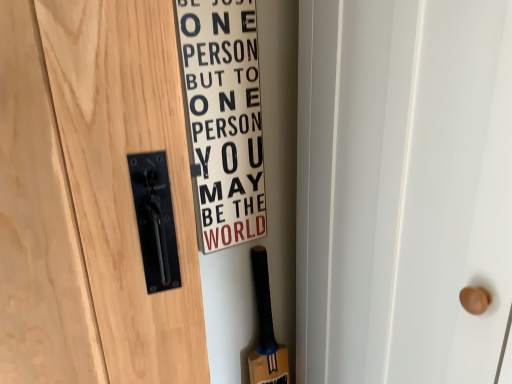
You are a GUI agent. You are given a task and a screenshot of the screen. Output one action in this format:
    pyautogui.click(x=<x>, y=<y>)
    Task: Click on the white matte sign at center
    The image size is (512, 384).
    Given the screenshot: What is the action you would take?
    pyautogui.click(x=223, y=118)

Describe the element at coordinates (223, 118) in the screenshot. I see `white matte sign at center` at that location.

In order to face black rubber baseball bat at lower right, should I rotate leftwards or rightwards?

Rotate right and turn 2.827 degrees.

The image size is (512, 384). Describe the element at coordinates (266, 330) in the screenshot. I see `black rubber baseball bat at lower right` at that location.

The height and width of the screenshot is (384, 512). What are the coordinates of `black rubber baseball bat at lower right` in the screenshot? It's located at (266, 330).

You are a GUI agent. You are given a task and a screenshot of the screen. Output one action in this format:
    pyautogui.click(x=<x>, y=<y>)
    Task: Click on the white matte sign at center
    The height and width of the screenshot is (384, 512).
    Given the screenshot: What is the action you would take?
    pyautogui.click(x=223, y=118)

Which object is positioned more to the right, black rubber baseball bat at lower right or white matte sign at center?

From the viewer's perspective, black rubber baseball bat at lower right appears more on the right side.

Which object is further away from the camera taking this photo, black rubber baseball bat at lower right or white matte sign at center?

black rubber baseball bat at lower right is further from the camera.

Which is in front, point (274, 374) or point (254, 45)?

The point (254, 45) is closer.

From the image's perspective, between black rubber baseball bat at lower right and white matte sign at center, which one is located above?

white matte sign at center appears higher in the image.

From a real-world perspective, is black rubber baseball bat at lower right beneath white matte sign at center?

Indeed, from a real-world perspective, black rubber baseball bat at lower right is positioned beneath white matte sign at center.

Consider the image. Is black rubber baseball bat at lower right wider than white matte sign at center?

Correct, the width of black rubber baseball bat at lower right exceeds that of white matte sign at center.

Between black rubber baseball bat at lower right and white matte sign at center, which one has more height?

Standing taller between the two is white matte sign at center.

Considering the sizes of objects black rubber baseball bat at lower right and white matte sign at center in the image provided, who is bigger, black rubber baseball bat at lower right or white matte sign at center?

black rubber baseball bat at lower right is bigger.

Is black rubber baseball bat at lower right located outside white matte sign at center?

black rubber baseball bat at lower right lies outside white matte sign at center's area.

Can you see black rubber baseball bat at lower right touching white matte sign at center?

No, black rubber baseball bat at lower right is not next to white matte sign at center.

Is black rubber baseball bat at lower right aimed at white matte sign at center?

No.

How many degrees apart are the facing directions of black rubber baseball bat at lower right and white matte sign at center?

The facing directions of black rubber baseball bat at lower right and white matte sign at center are 5.39 degrees apart.

Where is `warning sign that appears above the black rubber baseball bat at lower right (from the image's perspective)`? warning sign that appears above the black rubber baseball bat at lower right (from the image's perspective) is located at coordinates (223, 118).

Considering the positions of objects white matte sign at center and black rubber baseball bat at lower right in the image provided, who is more to the right, white matte sign at center or black rubber baseball bat at lower right?

black rubber baseball bat at lower right.

From the picture: In the image, is white matte sign at center positioned in front of or behind black rubber baseball bat at lower right?

white matte sign at center is in front of black rubber baseball bat at lower right.

Does point (253, 37) appear closer or farther from the camera than point (280, 368)?

Point (253, 37) is positioned closer to the camera compared to point (280, 368).

From the image's perspective, is white matte sign at center beneath black rubber baseball bat at lower right?

No, from the image's perspective, white matte sign at center is not beneath black rubber baseball bat at lower right.

From a real-world perspective, is white matte sign at center physically above black rubber baseball bat at lower right?

Indeed, from a real-world perspective, white matte sign at center stands above black rubber baseball bat at lower right.

Does white matte sign at center have a greater width compared to black rubber baseball bat at lower right?

In fact, white matte sign at center might be narrower than black rubber baseball bat at lower right.

Considering the relative sizes of white matte sign at center and black rubber baseball bat at lower right in the image provided, is white matte sign at center taller than black rubber baseball bat at lower right?

Indeed, white matte sign at center has a greater height compared to black rubber baseball bat at lower right.

Who is bigger, white matte sign at center or black rubber baseball bat at lower right?

With larger size is black rubber baseball bat at lower right.

Do you think white matte sign at center is within black rubber baseball bat at lower right, or outside of it?

The correct answer is: outside.

Are white matte sign at center and black rubber baseball bat at lower right beside each other?

No.

Is white matte sign at center oriented away from black rubber baseball bat at lower right?

No, white matte sign at center's orientation is not away from black rubber baseball bat at lower right.

What's the angular difference between white matte sign at center and black rubber baseball bat at lower right's facing directions?

The angle between the facing direction of white matte sign at center and the facing direction of black rubber baseball bat at lower right is 5.39 degrees.

I want to click on warning sign above the black rubber baseball bat at lower right (from the image's perspective), so click(x=223, y=118).

Find the location of a particular element. baseball bat below the white matte sign at center (from the image's perspective) is located at coordinates (266, 330).

Image resolution: width=512 pixels, height=384 pixels. Identify the location of baseball bat that appears behind the white matte sign at center. (266, 330).